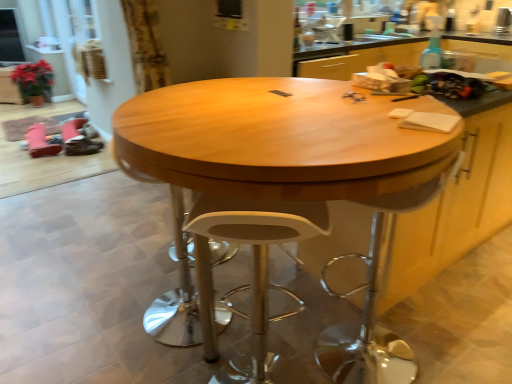
The width and height of the screenshot is (512, 384). What are the coordinates of `free spot behind white plastic stool at center` in the screenshot? It's located at (267, 340).